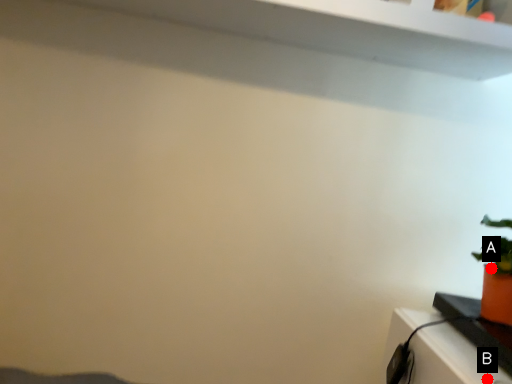
Question: Two points are circled on the image, labeled by A and B beside each circle. Which point is closer to the camera?

Choices:
 (A) A is closer
 (B) B is closer

Answer: (B)